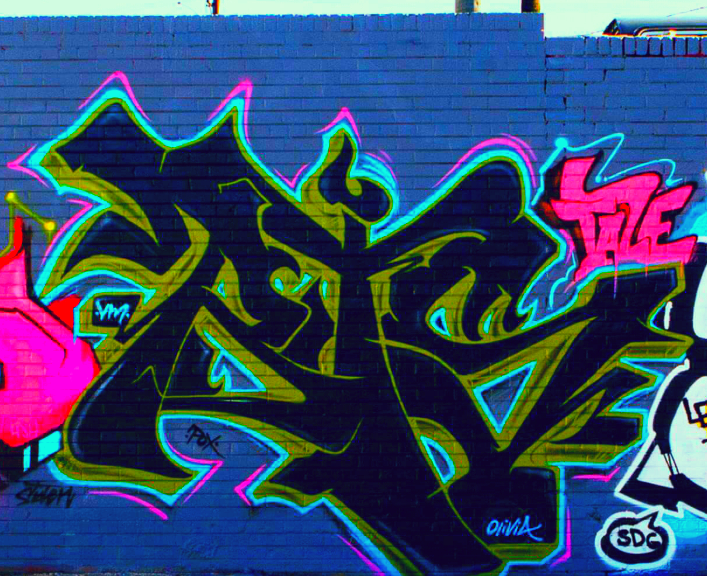
Image resolution: width=707 pixels, height=577 pixels. Find the location of `gold border`. gold border is located at coordinates (170, 280).